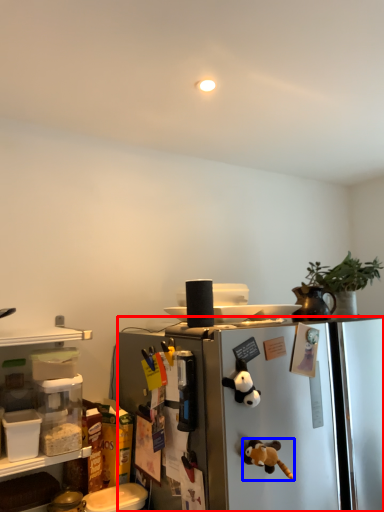
Question: Which object is further to the camera taking this photo, refrigerator (highlighted by a red box) or toy (highlighted by a blue box)?

Choices:
 (A) refrigerator
 (B) toy

Answer: (B)